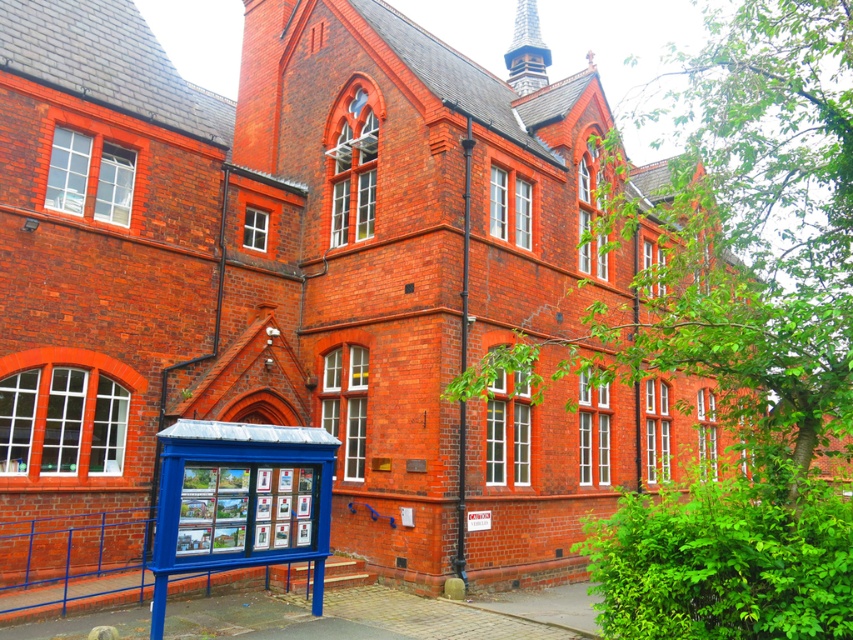
In the scene shown: Is blue metallic bus stop at lower left to the left of wooden spire at upper center from the viewer's perspective?

Indeed, blue metallic bus stop at lower left is positioned on the left side of wooden spire at upper center.

Locate an element on the screen. blue metallic bus stop at lower left is located at coordinates (241, 500).

At what (x,y) coordinates should I click in order to perform the action: click on blue metallic bus stop at lower left. Please return your answer as a coordinate pair (x, y). This screenshot has height=640, width=853. Looking at the image, I should click on (241, 500).